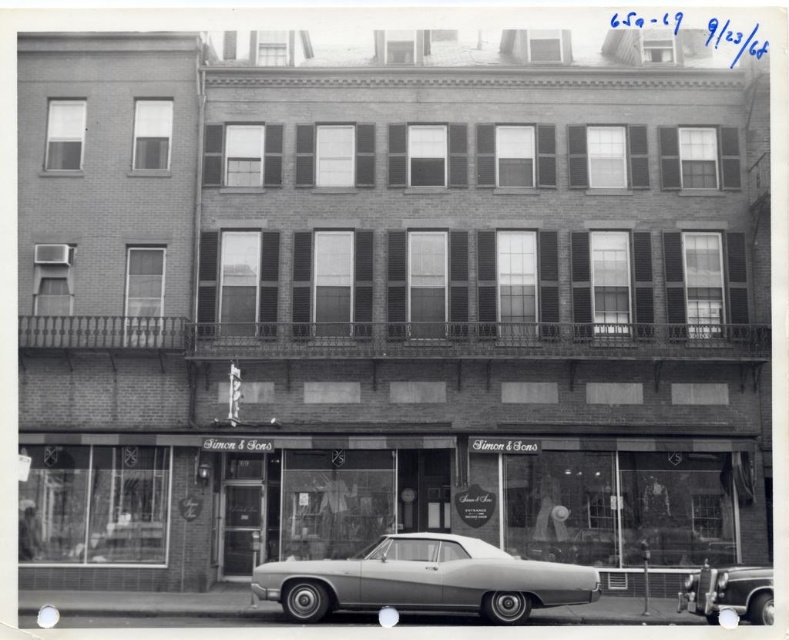
Can you confirm if silver metallic car at center is positioned above shiny silver sedan at center?

Yes.

Does silver metallic car at center have a greater height compared to shiny silver sedan at center?

Yes, silver metallic car at center is taller than shiny silver sedan at center.

Which is in front, point (352, 560) or point (768, 618)?

Point (768, 618) is in front.

Locate an element on the screen. silver metallic car at center is located at coordinates (424, 580).

Who is higher up, glass storefront at center or silver metallic car at center?

glass storefront at center is above.

Which is below, glass storefront at center or silver metallic car at center?

silver metallic car at center

What do you see at coordinates (380, 506) in the screenshot?
I see `glass storefront at center` at bounding box center [380, 506].

Locate an element on the screen. The height and width of the screenshot is (640, 789). glass storefront at center is located at coordinates (380, 506).

Looking at this image, does glass storefront at center have a greater height compared to shiny silver sedan at center?

Yes, glass storefront at center is taller than shiny silver sedan at center.

Is glass storefront at center positioned at the back of shiny silver sedan at center?

Yes, it is behind shiny silver sedan at center.

Locate an element on the screen. glass storefront at center is located at coordinates (380, 506).